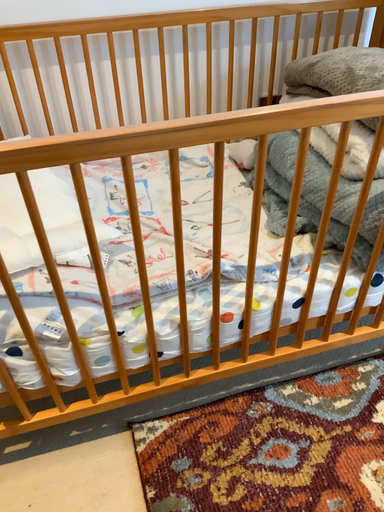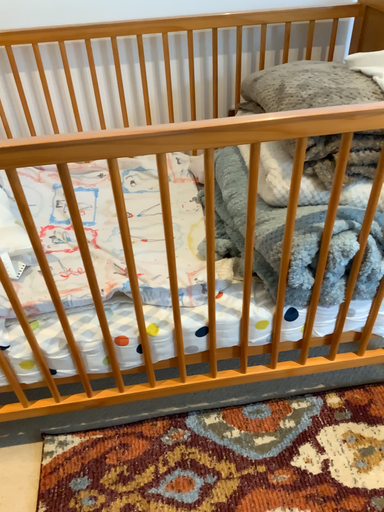
Question: How did the camera likely rotate when shooting the video?

Choices:
 (A) rotated right
 (B) rotated left

Answer: (B)